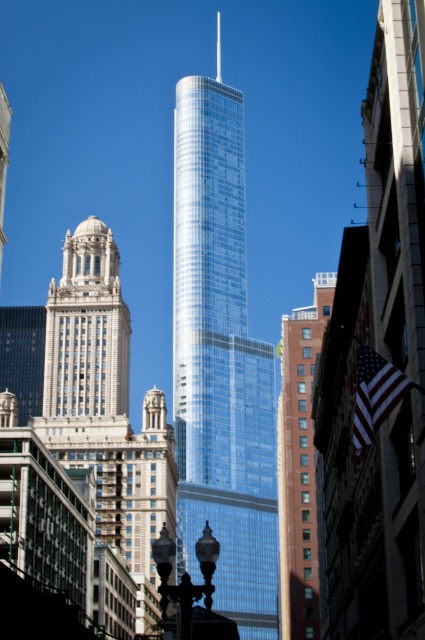
Question: Does shiny glass skyscraper at center have a greater width compared to white stone tower at left?

Choices:
 (A) yes
 (B) no

Answer: (B)

Question: Is shiny glass skyscraper at center further to camera compared to white stone tower at left?

Choices:
 (A) yes
 (B) no

Answer: (A)

Question: Which point is closer to the camera taking this photo?

Choices:
 (A) (235, 570)
 (B) (116, 493)

Answer: (B)

Question: Which point is farther to the camera?

Choices:
 (A) (311, 360)
 (B) (221, 502)
 (C) (119, 474)
 (D) (379, 365)

Answer: (B)

Question: Which of these objects is positioned farthest from the white stone tower at left?

Choices:
 (A) glassy steel skyscraper at right
 (B) silky fabric flag at right

Answer: (B)

Question: Is shiny glass skyscraper at center bigger than silky fabric flag at right?

Choices:
 (A) yes
 (B) no

Answer: (A)